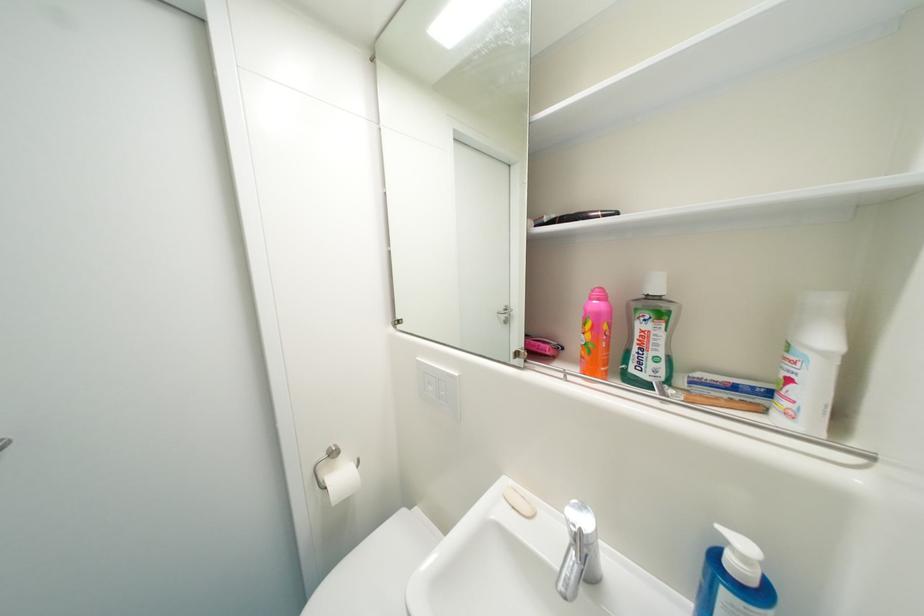
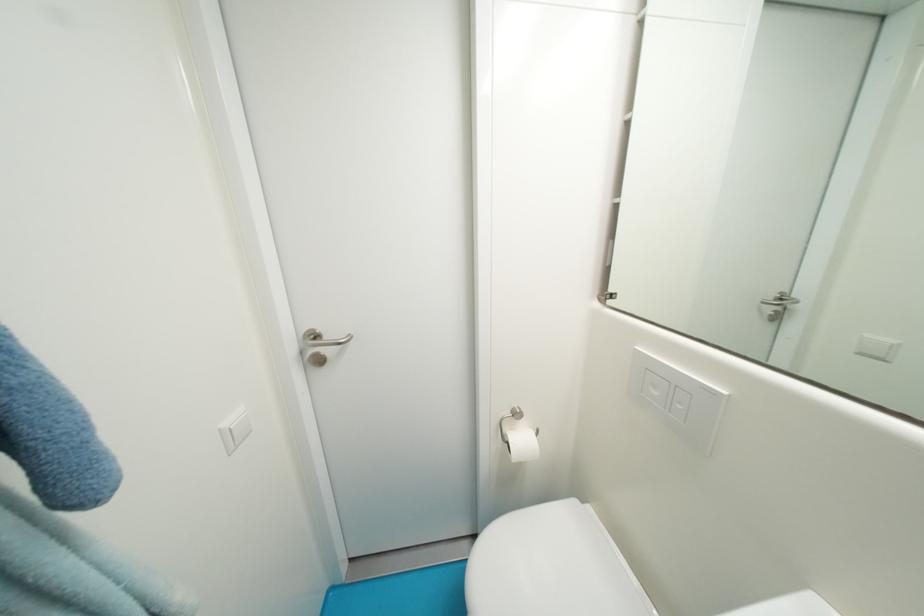
In the second image, find the point that corresponds to (x=438, y=390) in the first image.

(662, 395)